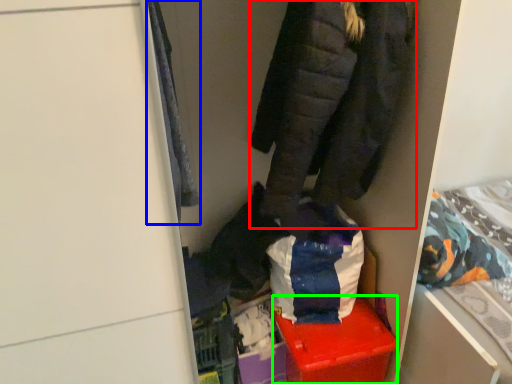
Question: Which object is the closest to the jacket (highlighted by a red box)? Choose among these: cloak (highlighted by a blue box) or storage box (highlighted by a green box).

Choices:
 (A) cloak
 (B) storage box

Answer: (A)